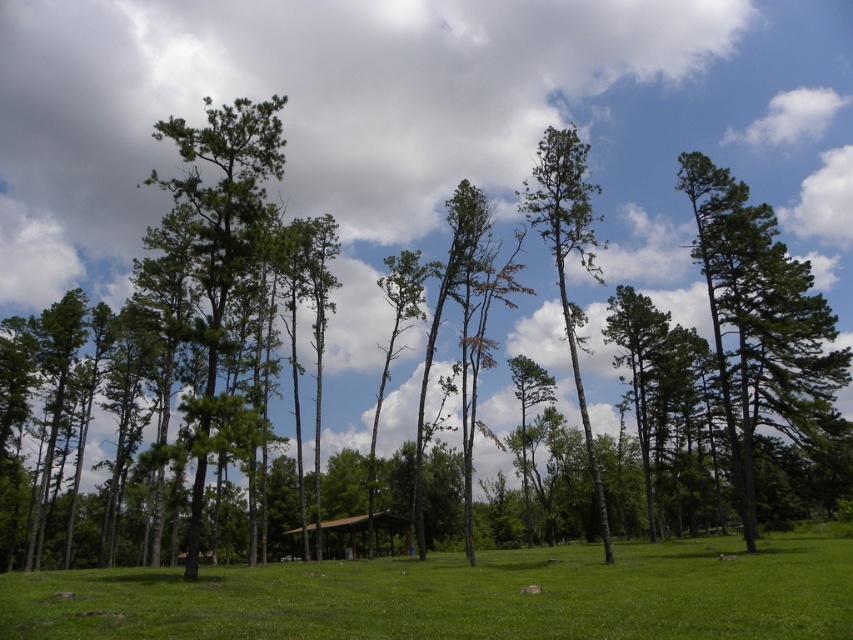
Which of these two, green matte tree at right or green bark tree at center, stands shorter?

green matte tree at right

Between point (819, 352) and point (578, 387), which one is positioned in front?

Point (578, 387)

I want to click on green matte tree at right, so click(x=759, y=324).

At what (x,y) coordinates should I click in order to perform the action: click on green matte tree at right. Please return your answer as a coordinate pair (x, y). This screenshot has height=640, width=853. Looking at the image, I should click on (759, 324).

Who is more forward, (822, 352) or (357, 522)?

Point (357, 522)

The width and height of the screenshot is (853, 640). In order to click on green matte tree at right in this screenshot , I will do `click(759, 324)`.

The height and width of the screenshot is (640, 853). I want to click on green matte tree at right, so click(759, 324).

Is point (144, 632) farther from viewer compared to point (782, 413)?

No, (144, 632) is in front of (782, 413).

This screenshot has height=640, width=853. In order to click on green grass at center in this screenshot , I will do `click(460, 595)`.